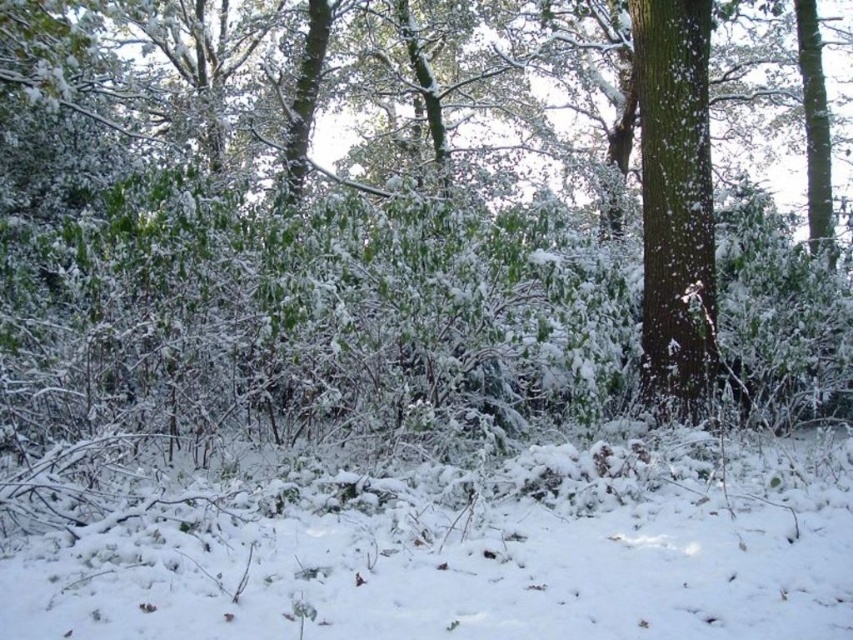
Question: Can you confirm if white fluffy snow at lower center is bigger than green rough bark tree at right?

Choices:
 (A) no
 (B) yes

Answer: (A)

Question: Does white fluffy snow at lower center appear on the left side of green rough bark tree at right?

Choices:
 (A) yes
 (B) no

Answer: (A)

Question: Is white fluffy snow at lower center to the left of green rough bark tree at right from the viewer's perspective?

Choices:
 (A) yes
 (B) no

Answer: (A)

Question: Which object is closer to the camera taking this photo?

Choices:
 (A) white fluffy snow at lower center
 (B) green rough bark tree at right

Answer: (A)

Question: Which point is closer to the camera taking this photo?

Choices:
 (A) (845, 436)
 (B) (697, 371)

Answer: (A)

Question: Which object appears farthest from the camera in this image?

Choices:
 (A) green rough bark tree at right
 (B) white fluffy snow at lower center

Answer: (A)